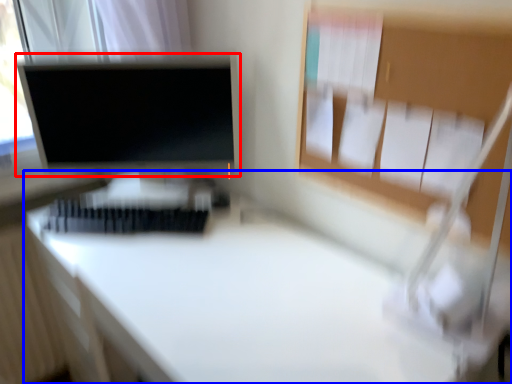
Question: Which object appears farthest to the camera in this image, computer monitor (highlighted by a red box) or desk (highlighted by a blue box)?

Choices:
 (A) computer monitor
 (B) desk

Answer: (A)